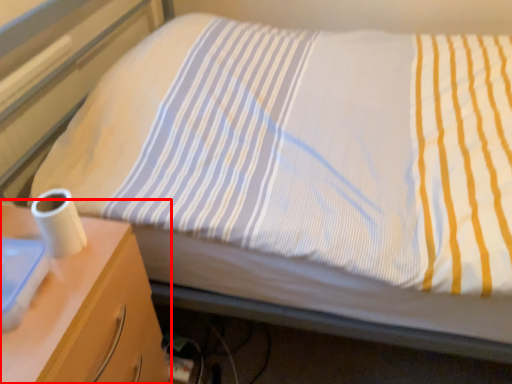
Question: From the image's perspective, what is the correct spatial positioning of nightstand (annotated by the red box) in reference to toilet paper?

Choices:
 (A) above
 (B) below

Answer: (B)